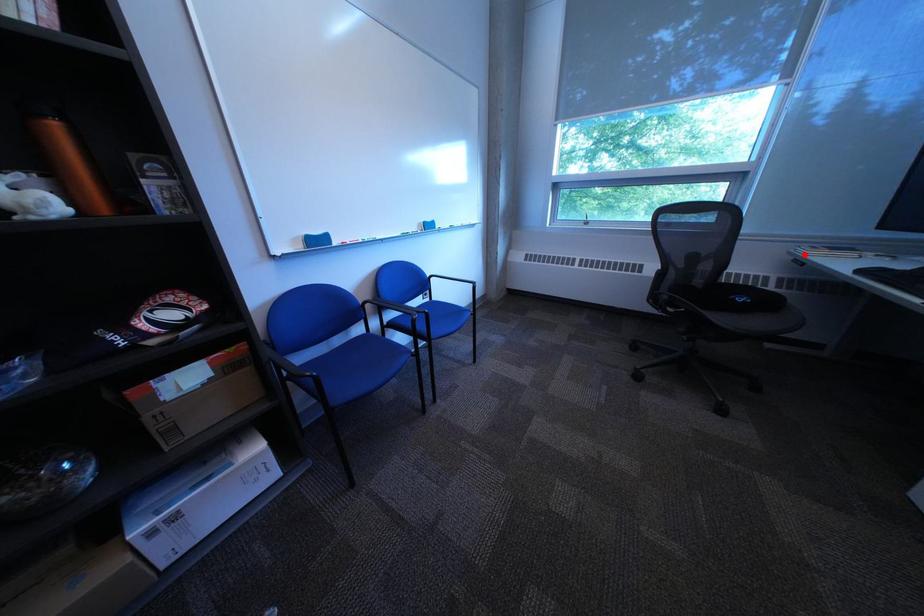
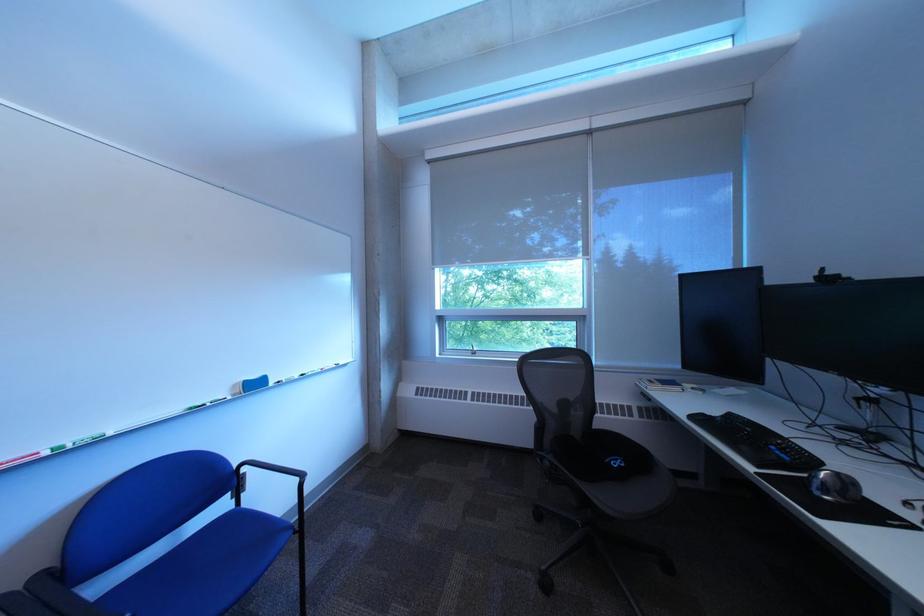
Question: I am providing you with two images of the same scene from different viewpoints. Image1 has a red point marked. In image2, the corresponding 3D location appears at what relative position? Reply with the corresponding letter.

Choices:
 (A) Closer
 (B) Farther

Answer: (B)